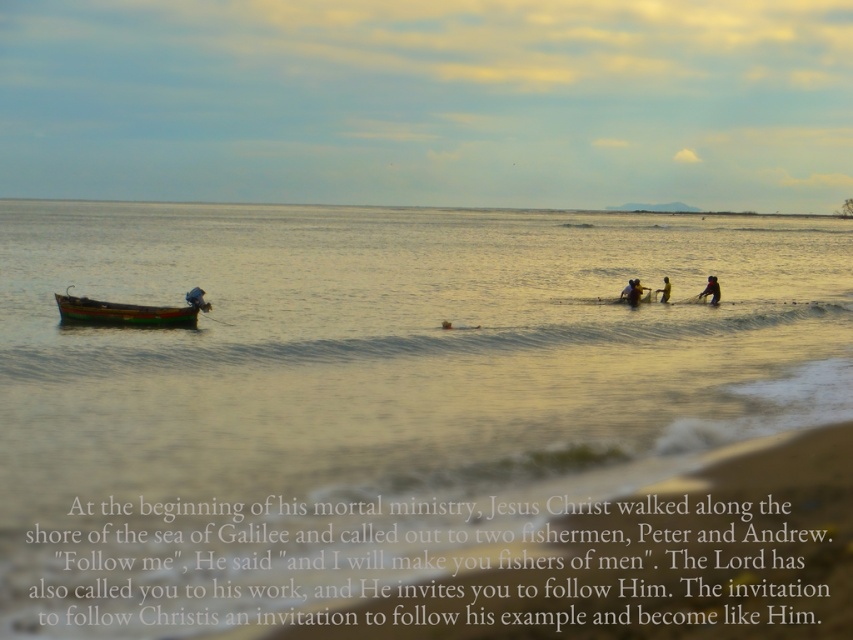
Consider the image. You are a photographer standing on the beach and want to capture the smooth golden water at center and the dark blue fabric at lower right in the same frame. Which object should you adjust your camera angle to focus on first to ensure both are visible?

The smooth golden water at center is positioned over dark blue fabric at lower right, so you should focus on the dark blue fabric at lower right first to ensure both are visible in the frame.

You are a photographer standing on the beach and want to capture both the smooth golden water at center and the dark blue fabric at lower right in your photo. Which object should you focus on first to ensure both are in frame?

You should focus on the dark blue fabric at lower right first because the smooth golden water at center is in front of it, so adjusting the camera angle to include the dark blue fabric at lower right while keeping the smooth golden water at center in view will ensure both are captured.